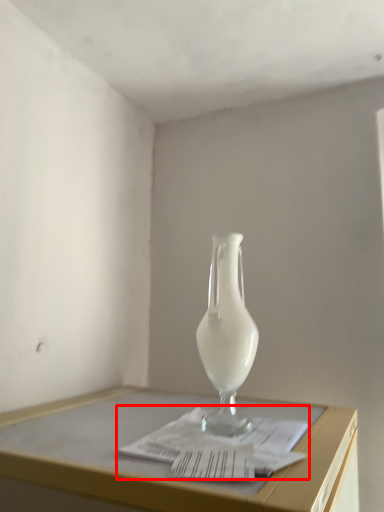
Question: From the image's perspective, what is the correct spatial relationship of magazine (annotated by the red box) in relation to vase?

Choices:
 (A) above
 (B) below

Answer: (B)